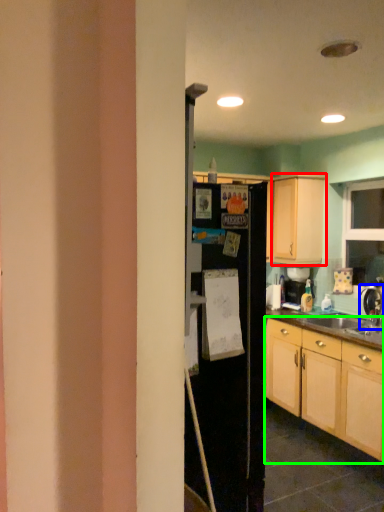
Question: Which is farther away from cabinetry (highlighted by a red box)? tap (highlighted by a blue box) or cabinetry (highlighted by a green box)?

Choices:
 (A) tap
 (B) cabinetry

Answer: (B)